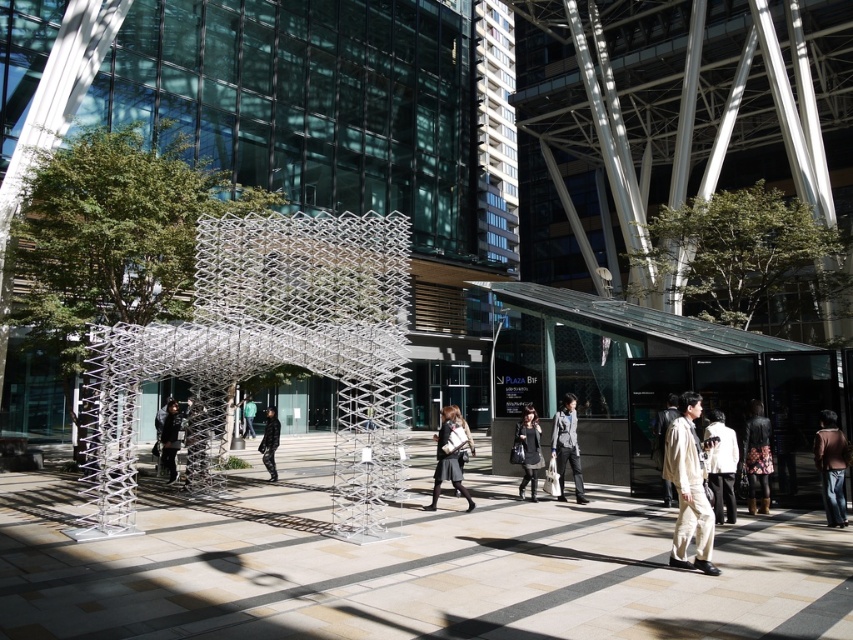
Question: In this image, where is light beige fabric pants at lower right located relative to light gray fabric coat at center?

Choices:
 (A) below
 (B) above

Answer: (B)

Question: Can you confirm if matte black jacket at center is positioned to the left of dark gray fabric coat at center?

Choices:
 (A) no
 (B) yes

Answer: (A)

Question: Which object appears closest to the camera in this image?

Choices:
 (A) white cotton shirt at lower right
 (B) dark gray fabric bag at center

Answer: (A)

Question: Which object is positioned farthest from the green fabric jacket at center?

Choices:
 (A) dark gray fabric bag at center
 (B) black leather coat at center
 (C) matte black jacket at center

Answer: (A)

Question: Based on their relative distances, which object is nearer to the green fabric jacket at center?

Choices:
 (A) black leather jacket at center
 (B) white cotton shirt at lower right
 (C) black leather coat at center
 (D) light beige fabric coat at center

Answer: (A)

Question: Observing the image, what is the correct spatial positioning of brown leather jacket at lower right in reference to light gray fabric coat at center?

Choices:
 (A) left
 (B) right

Answer: (B)